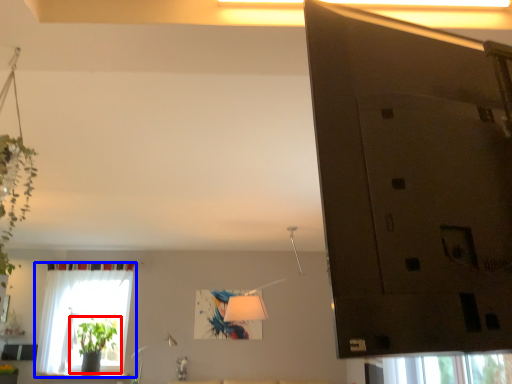
Question: Which object appears closest to the camera in this image, houseplant (highlighted by a red box) or window (highlighted by a blue box)?

Choices:
 (A) houseplant
 (B) window

Answer: (B)